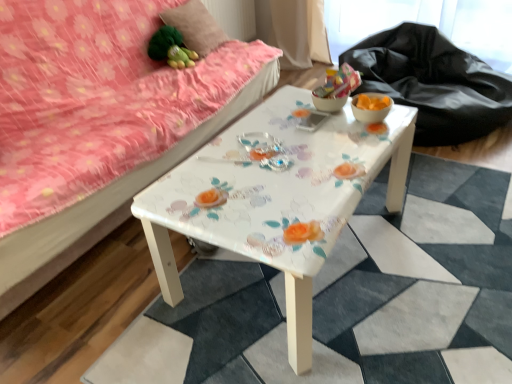
Identify the location of free spot above white glossy table at center (from a real-world perspective). This screenshot has height=384, width=512. (288, 155).